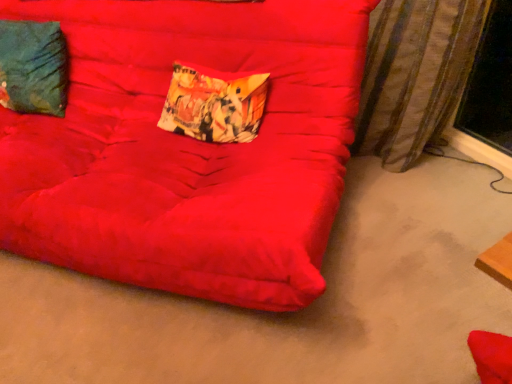
Locate an element on the screen. printed fabric pillow at center, arranged as the second pillow when viewed from the left is located at coordinates (214, 104).

Image resolution: width=512 pixels, height=384 pixels. What are the coordinates of `striped fabric curtain at right` in the screenshot? It's located at (414, 75).

Image resolution: width=512 pixels, height=384 pixels. What do you see at coordinates (414, 75) in the screenshot?
I see `striped fabric curtain at right` at bounding box center [414, 75].

Find the location of a particular element. The height and width of the screenshot is (384, 512). suede-like red futon at center is located at coordinates pyautogui.click(x=188, y=148).

Is suede-like red futon at center bigger or smaller than striped fabric curtain at right?

In the image, suede-like red futon at center appears to be larger than striped fabric curtain at right.

Is suede-like red futon at center taller than striped fabric curtain at right?

Yes.

Is suede-like red futon at center inside or outside of striped fabric curtain at right?

The correct answer is: outside.

Can you tell me how much suede-like red futon at center and striped fabric curtain at right differ in facing direction?

They differ by 41.1 degrees in their facing directions.

Between teal fabric pillow at upper left, the 2th pillow positioned from the right, and suede-like red futon at center, which one appears on the right side from the viewer's perspective?

Positioned to the right is suede-like red futon at center.

Between teal fabric pillow at upper left, the 2th pillow positioned from the right, and suede-like red futon at center, which one is positioned behind?

teal fabric pillow at upper left, the 2th pillow positioned from the right, is behind.

Which point is more distant from viewer, (32,37) or (224,152)?

The point (32,37) is farther.

Where is `furniture below the teal fabric pillow at upper left, the 2th pillow positioned from the right (from a real-world perspective)`? Image resolution: width=512 pixels, height=384 pixels. furniture below the teal fabric pillow at upper left, the 2th pillow positioned from the right (from a real-world perspective) is located at coordinates (188, 148).

Is suede-like red futon at center far from teal fabric pillow at upper left, arranged as the 1th pillow when viewed from the left?

They are positioned close to each other.

From a real-world perspective, relative to teal fabric pillow at upper left, the 2th pillow positioned from the right, is suede-like red futon at center vertically above or below?

suede-like red futon at center is below teal fabric pillow at upper left, the 2th pillow positioned from the right.

Is suede-like red futon at center oriented away from teal fabric pillow at upper left, the 2th pillow positioned from the right?

Yes.

Locate an element on the screen. This screenshot has width=512, height=384. pillow that is the 2nd one when counting backward from the suede-like red futon at center is located at coordinates (33, 67).

From the image's perspective, is suede-like red futon at center positioned above or below printed fabric pillow at center, arranged as the second pillow when viewed from the left?

suede-like red futon at center is situated lower than printed fabric pillow at center, arranged as the second pillow when viewed from the left, in the image.

Between suede-like red futon at center and printed fabric pillow at center, which is the 1th pillow from right to left, which one has smaller width?

Thinner between the two is printed fabric pillow at center, which is the 1th pillow from right to left.

Is suede-like red futon at center taller than printed fabric pillow at center, which is the 1th pillow from right to left?

Correct, suede-like red futon at center is much taller as printed fabric pillow at center, which is the 1th pillow from right to left.

Based on their sizes in the image, would you say suede-like red futon at center is bigger or smaller than printed fabric pillow at center, which is the 1th pillow from right to left?

suede-like red futon at center is bigger than printed fabric pillow at center, which is the 1th pillow from right to left.

Is printed fabric pillow at center, arranged as the second pillow when viewed from the left, to the left of striped fabric curtain at right from the viewer's perspective?

Yes.

Which object is more forward, printed fabric pillow at center, which is the 1th pillow from right to left, or striped fabric curtain at right?

striped fabric curtain at right.

Which point is more distant from viewer, (233, 102) or (376, 39)?

The point (376, 39) is behind.

Does point (256, 136) appear closer or farther from the camera than point (105, 44)?

Point (256, 136) is positioned closer to the camera compared to point (105, 44).

Is printed fabric pillow at center, which is the 1th pillow from right to left, facing towards suede-like red futon at center?

Yes.

From the picture: Considering the positions of objects printed fabric pillow at center, which is the 1th pillow from right to left, and suede-like red futon at center in the image provided, who is more to the left, printed fabric pillow at center, which is the 1th pillow from right to left, or suede-like red futon at center?

suede-like red futon at center.

From the image's perspective, does printed fabric pillow at center, which is the 1th pillow from right to left, appear higher than suede-like red futon at center?

Correct, printed fabric pillow at center, which is the 1th pillow from right to left, appears higher than suede-like red futon at center in the image.

Can you see teal fabric pillow at upper left, the 2th pillow positioned from the right, touching printed fabric pillow at center, which is the 1th pillow from right to left?

No, teal fabric pillow at upper left, the 2th pillow positioned from the right, is not making contact with printed fabric pillow at center, which is the 1th pillow from right to left.

Is teal fabric pillow at upper left, arranged as the 1th pillow when viewed from the left, positioned with its back to printed fabric pillow at center, which is the 1th pillow from right to left?

No, teal fabric pillow at upper left, arranged as the 1th pillow when viewed from the left, is not facing away from printed fabric pillow at center, which is the 1th pillow from right to left.

Which object is positioned more to the left, teal fabric pillow at upper left, arranged as the 1th pillow when viewed from the left, or printed fabric pillow at center, arranged as the second pillow when viewed from the left?

teal fabric pillow at upper left, arranged as the 1th pillow when viewed from the left, is more to the left.

Where is `furniture in front of the striped fabric curtain at right`? This screenshot has width=512, height=384. furniture in front of the striped fabric curtain at right is located at coordinates (188, 148).

Identify the location of pillow on the left of suede-like red futon at center. This screenshot has height=384, width=512. (33, 67).

Estimate the real-world distances between objects in this image. Which object is closer to suede-like red futon at center, printed fabric pillow at center, arranged as the second pillow when viewed from the left, or striped fabric curtain at right?

Based on the image, printed fabric pillow at center, arranged as the second pillow when viewed from the left, appears to be nearer to suede-like red futon at center.

Based on their spatial positions, is teal fabric pillow at upper left, the 2th pillow positioned from the right, or suede-like red futon at center further from printed fabric pillow at center, which is the 1th pillow from right to left?

teal fabric pillow at upper left, the 2th pillow positioned from the right, lies further to printed fabric pillow at center, which is the 1th pillow from right to left, than the other object.

From the picture: When comparing their distances from teal fabric pillow at upper left, arranged as the 1th pillow when viewed from the left, does striped fabric curtain at right or suede-like red futon at center seem closer?

Among the two, suede-like red futon at center is located nearer to teal fabric pillow at upper left, arranged as the 1th pillow when viewed from the left.

From the image, which object appears to be nearer to suede-like red futon at center, teal fabric pillow at upper left, the 2th pillow positioned from the right, or printed fabric pillow at center, arranged as the second pillow when viewed from the left?

printed fabric pillow at center, arranged as the second pillow when viewed from the left.

Looking at the image, which one is located further to striped fabric curtain at right, printed fabric pillow at center, which is the 1th pillow from right to left, or suede-like red futon at center?

The object further to striped fabric curtain at right is printed fabric pillow at center, which is the 1th pillow from right to left.

Estimate the real-world distances between objects in this image. Which object is further from printed fabric pillow at center, which is the 1th pillow from right to left, suede-like red futon at center or teal fabric pillow at upper left, arranged as the 1th pillow when viewed from the left?

Based on the image, teal fabric pillow at upper left, arranged as the 1th pillow when viewed from the left, appears to be further to printed fabric pillow at center, which is the 1th pillow from right to left.

From the image, which object appears to be nearer to suede-like red futon at center, striped fabric curtain at right or teal fabric pillow at upper left, the 2th pillow positioned from the right?

Based on the image, teal fabric pillow at upper left, the 2th pillow positioned from the right, appears to be nearer to suede-like red futon at center.

Which object lies further to the anchor point printed fabric pillow at center, which is the 1th pillow from right to left, suede-like red futon at center or striped fabric curtain at right?

striped fabric curtain at right lies further to printed fabric pillow at center, which is the 1th pillow from right to left, than the other object.

At what (x,y) coordinates should I click in order to perform the action: click on pillow between suede-like red futon at center and teal fabric pillow at upper left, arranged as the 1th pillow when viewed from the left, along the z-axis. Please return your answer as a coordinate pair (x, y). Looking at the image, I should click on (214, 104).

Identify the location of furniture between teal fabric pillow at upper left, arranged as the 1th pillow when viewed from the left, and striped fabric curtain at right. This screenshot has height=384, width=512. (188, 148).

Identify the location of pillow situated between teal fabric pillow at upper left, the 2th pillow positioned from the right, and striped fabric curtain at right from left to right. (214, 104).

This screenshot has width=512, height=384. I want to click on pillow between suede-like red futon at center and striped fabric curtain at right, so click(214, 104).